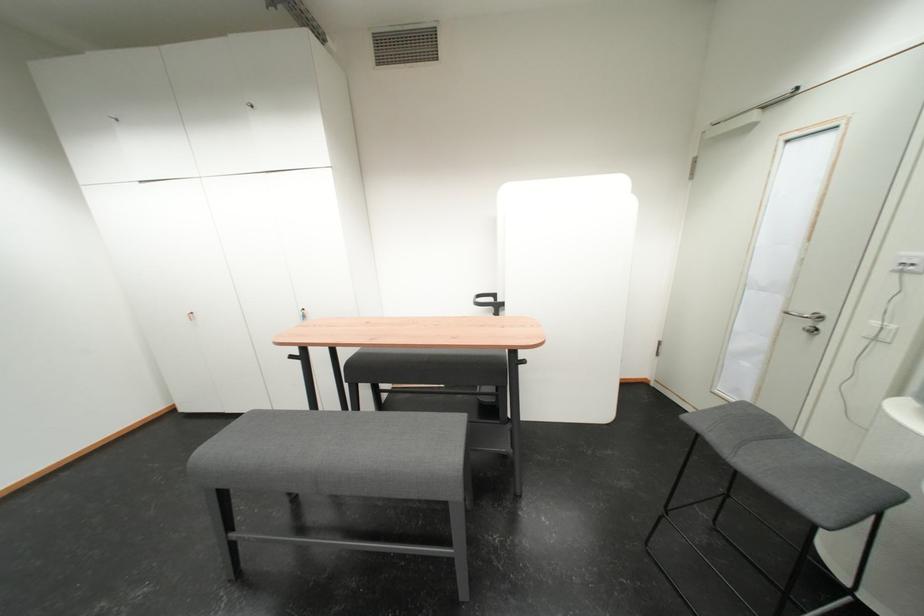
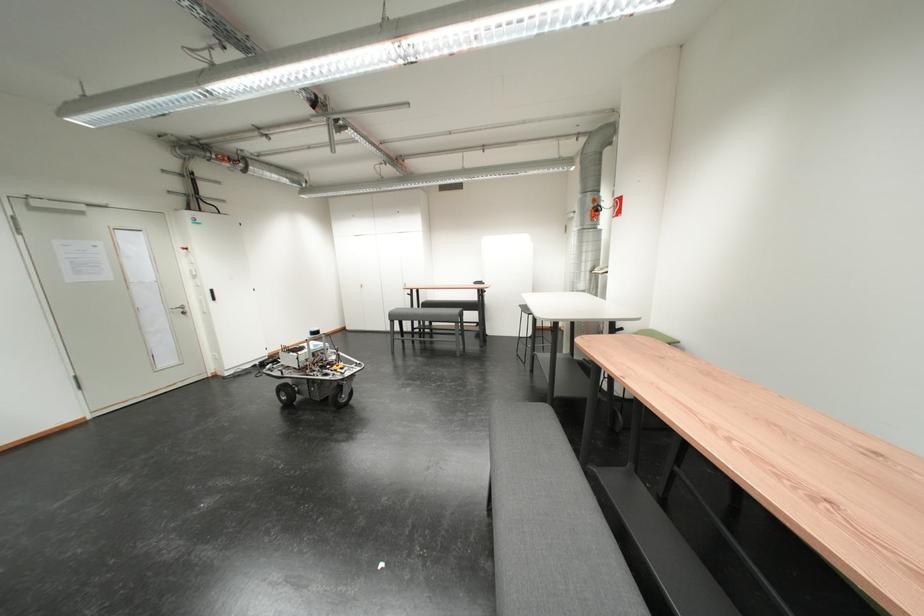
Question: Which direction would the cameraman need to move to produce the second image? Reply with the corresponding letter.

Choices:
 (A) Left
 (B) Right
 (C) Forward
 (D) Backward

Answer: (D)